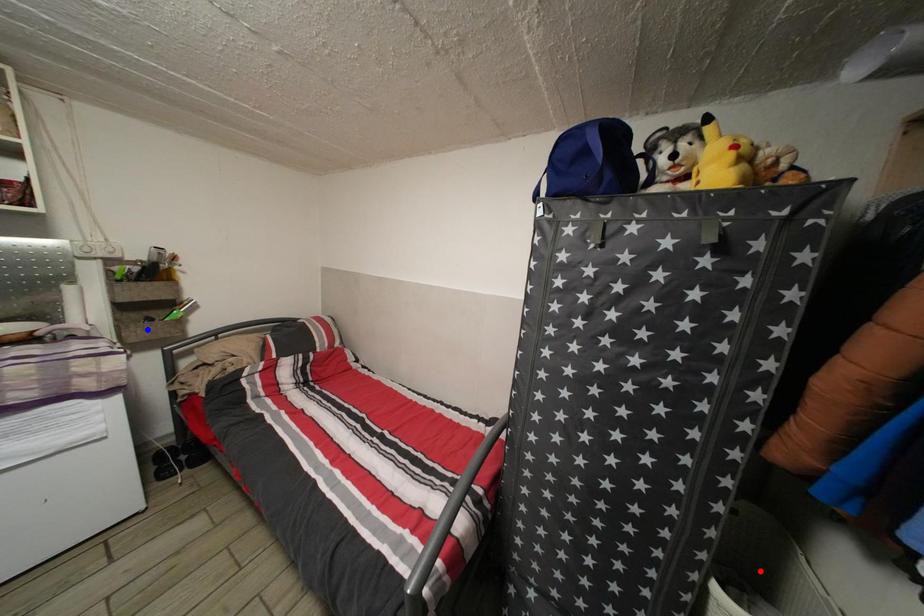
Question: Which of the two points in the image is closer to the camera?

Choices:
 (A) Blue point is closer.
 (B) Red point is closer.

Answer: (B)